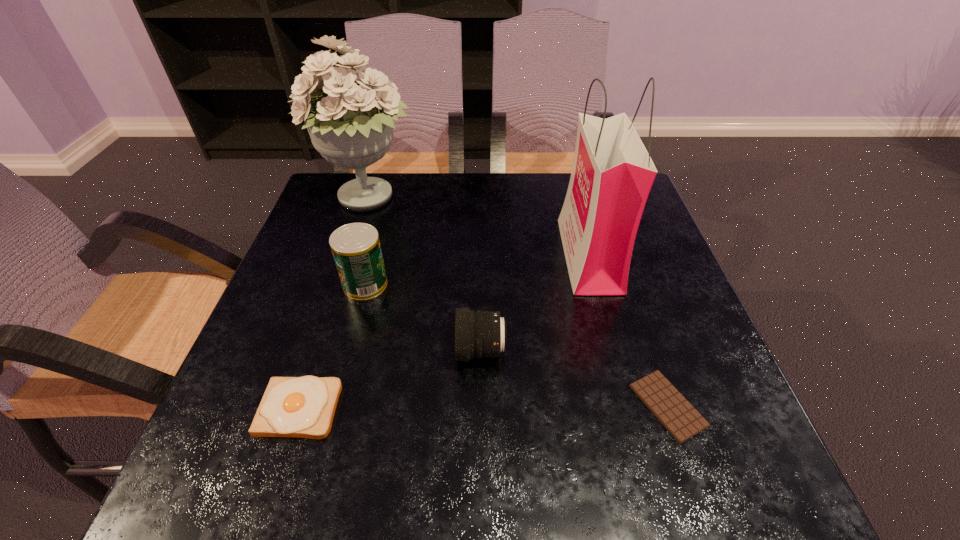
Select which object appears as the second closest to the bouquet. Please provide its 2D coordinates. Your answer should be formatted as a tuple, i.e. [(x, y)], where the tuple contains the x and y coordinates of a point satisfying the conditions above.

[(478, 334)]

The height and width of the screenshot is (540, 960). I want to click on the fourth closest object to the shortest object, so click(304, 407).

What are the coordinates of `vacant region that satisfies the following two spatial constraints: 1. on the front-facing side of the shopping bag; 2. on the back side of the shortest object` in the screenshot? It's located at (630, 406).

Where is `free point that satisfies the following two spatial constraints: 1. at the front element of the chocolate bar; 2. on the right side of the telephoto lens`? This screenshot has height=540, width=960. free point that satisfies the following two spatial constraints: 1. at the front element of the chocolate bar; 2. on the right side of the telephoto lens is located at coordinates (481, 406).

Identify the location of vacant space that satisfies the following two spatial constraints: 1. on the front-facing side of the chocolate bar; 2. on the right side of the shopping bag. (630, 406).

This screenshot has height=540, width=960. What are the coordinates of `vacant space that satisfies the following two spatial constraints: 1. at the front element of the chocolate bar; 2. on the right side of the third object from right to left` in the screenshot? It's located at (481, 406).